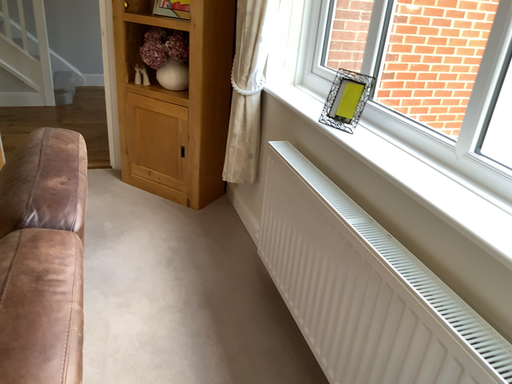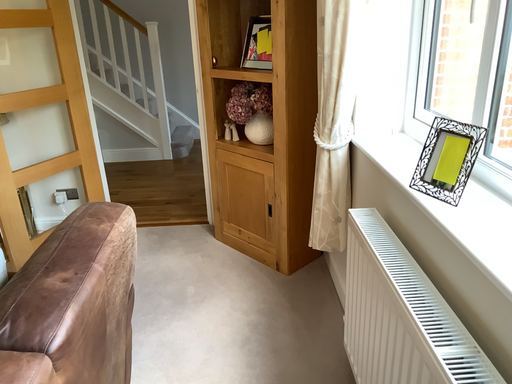
Question: How did the camera likely rotate when shooting the video?

Choices:
 (A) rotated right
 (B) rotated left

Answer: (B)